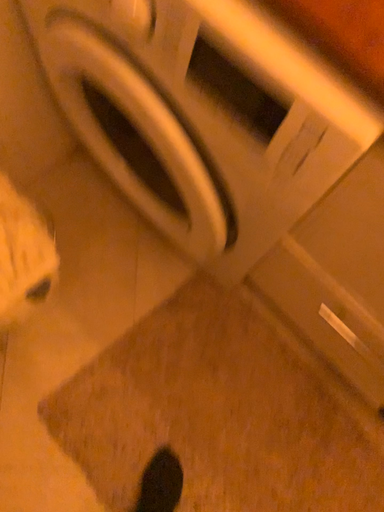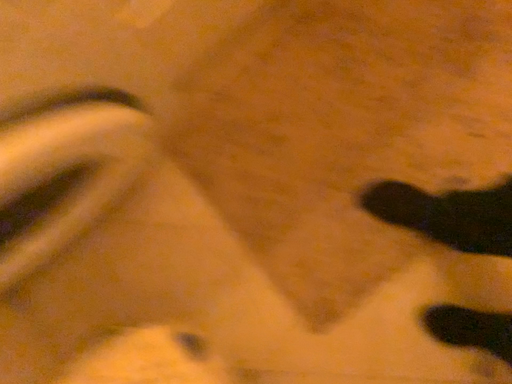
Question: How did the camera likely rotate when shooting the video?

Choices:
 (A) rotated left
 (B) rotated right

Answer: (B)